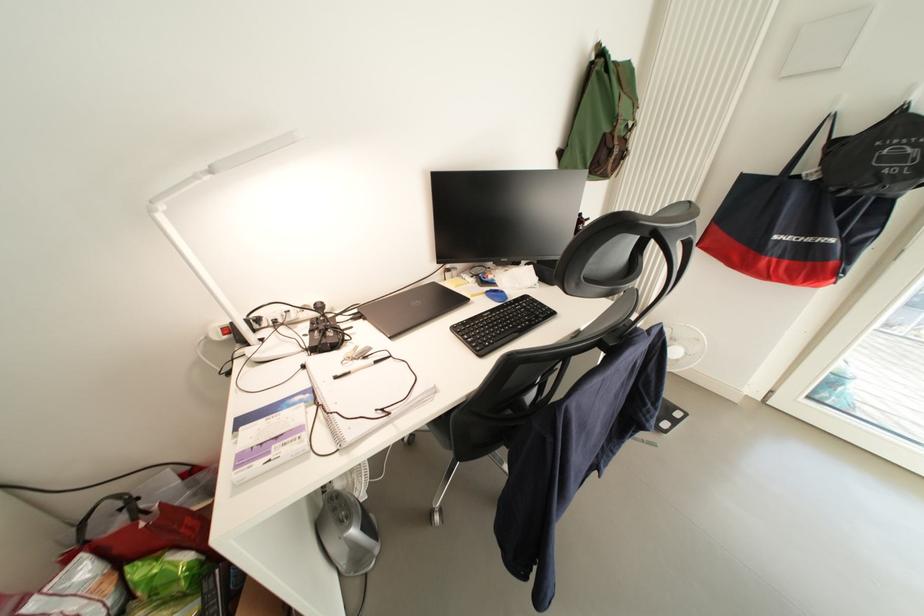
The location [361,367] corresponds to which object?

It refers to a white and black pen.